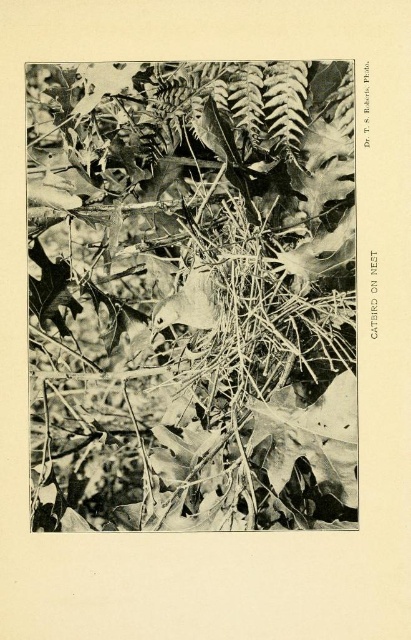
Between brown textured nest at center and smooth gray bird at center, which one appears on the right side from the viewer's perspective?

brown textured nest at center is more to the right.

Which is behind, point (89, 365) or point (193, 310)?

Point (89, 365)

The image size is (411, 640). What do you see at coordinates (180, 285) in the screenshot?
I see `brown textured nest at center` at bounding box center [180, 285].

Where is `brown textured nest at center`? brown textured nest at center is located at coordinates (180, 285).